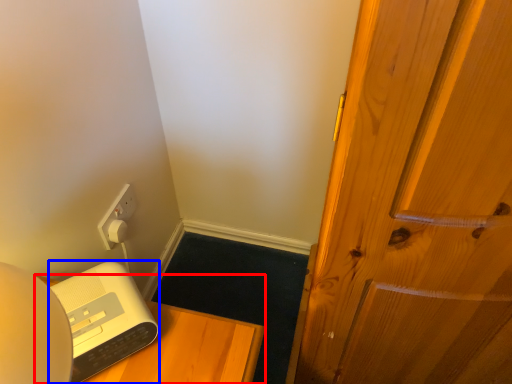
Question: Which object appears farthest to the camera in this image, furniture (highlighted by a red box) or appliance (highlighted by a blue box)?

Choices:
 (A) furniture
 (B) appliance

Answer: (A)